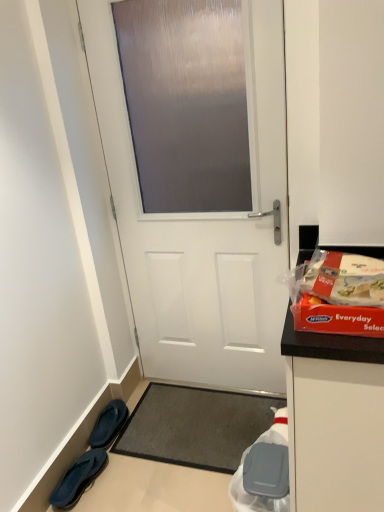
Question: From a real-world perspective, is blue fabric slippers at lower left, the 2th footwear viewed from the back, physically below red plastic box at right, arranged as the 1th waste when viewed from the top?

Choices:
 (A) yes
 (B) no

Answer: (A)

Question: Can red plastic box at right, acting as the 1th waste starting from the front, be found inside blue fabric slippers at lower left, the first footwear in the front-to-back sequence?

Choices:
 (A) no
 (B) yes

Answer: (A)

Question: Are blue fabric slippers at lower left, the 2th footwear viewed from the back, and red plastic box at right, arranged as the second waste when viewed from the back, located far from each other?

Choices:
 (A) yes
 (B) no

Answer: (A)

Question: From the image's perspective, is blue fabric slippers at lower left, the 2th footwear viewed from the back, located above red plastic box at right, arranged as the 1th waste when viewed from the top?

Choices:
 (A) yes
 (B) no

Answer: (B)

Question: Is blue fabric slippers at lower left, the 2th footwear viewed from the back, next to red plastic box at right, arranged as the second waste when viewed from the back?

Choices:
 (A) no
 (B) yes

Answer: (A)

Question: Does blue fabric slippers at lower left, the 2th footwear viewed from the back, have a lesser width compared to red plastic box at right, arranged as the 1th waste when viewed from the top?

Choices:
 (A) yes
 (B) no

Answer: (A)

Question: From a real-world perspective, is white plastic bag at lower right, the 1th waste from the back, below blue fabric slippers at lower left, the first footwear in the front-to-back sequence?

Choices:
 (A) no
 (B) yes

Answer: (A)

Question: Is blue fabric slippers at lower left, the 2th footwear viewed from the back, at the back of white plastic bag at lower right, which is the 1th waste from bottom to top?

Choices:
 (A) yes
 (B) no

Answer: (B)

Question: Is white plastic bag at lower right, positioned as the 2th waste in top-to-bottom order, in contact with blue fabric slippers at lower left, the 2th footwear viewed from the back?

Choices:
 (A) no
 (B) yes

Answer: (A)

Question: From a real-world perspective, is white plastic bag at lower right, arranged as the second waste when viewed from the front, physically above blue fabric slippers at lower left, the first footwear in the front-to-back sequence?

Choices:
 (A) yes
 (B) no

Answer: (A)

Question: Considering the relative sizes of white plastic bag at lower right, arranged as the second waste when viewed from the front, and blue fabric slippers at lower left, the 2th footwear viewed from the back, in the image provided, is white plastic bag at lower right, arranged as the second waste when viewed from the front, shorter than blue fabric slippers at lower left, the 2th footwear viewed from the back,?

Choices:
 (A) no
 (B) yes

Answer: (A)

Question: Considering the relative positions of white plastic bag at lower right, arranged as the second waste when viewed from the front, and blue fabric slippers at lower left, the 2th footwear viewed from the back, in the image provided, is white plastic bag at lower right, arranged as the second waste when viewed from the front, in front of blue fabric slippers at lower left, the 2th footwear viewed from the back,?

Choices:
 (A) no
 (B) yes

Answer: (B)

Question: From the image's perspective, is white matte door at center located beneath black fabric slippers at lower left, acting as the 1th footwear starting from the back?

Choices:
 (A) yes
 (B) no

Answer: (B)